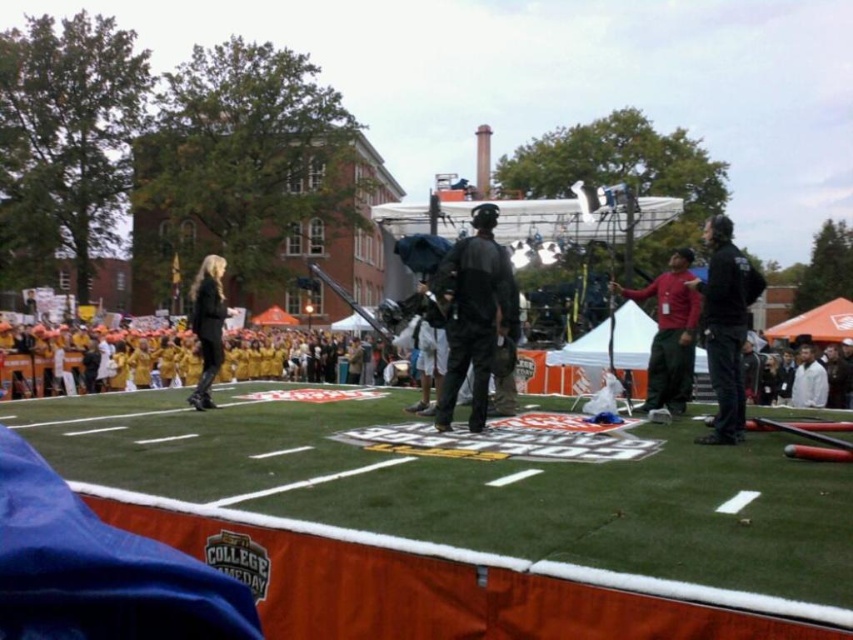
Who is lower down, dark gray fabric jacket at center or red matte shirt at center?

Positioned lower is red matte shirt at center.

Between dark gray fabric jacket at center and red matte shirt at center, which one appears on the right side from the viewer's perspective?

From the viewer's perspective, red matte shirt at center appears more on the right side.

Does point (457, 243) lie behind point (674, 268)?

No, it is not.

Identify the location of dark gray fabric jacket at center. (474, 314).

Who is taller, yellow fabric at center or dark gray fabric jacket at center?

With more height is dark gray fabric jacket at center.

What do you see at coordinates (151, 358) in the screenshot?
I see `yellow fabric at center` at bounding box center [151, 358].

Describe the element at coordinates (151, 358) in the screenshot. I see `yellow fabric at center` at that location.

This screenshot has height=640, width=853. Find the location of `yellow fabric at center`. yellow fabric at center is located at coordinates (151, 358).

Between dark gray fabric jacket at center and white matte jacket at right, which one appears on the right side from the viewer's perspective?

white matte jacket at right

Is point (477, 212) positioned before point (820, 372)?

Yes, point (477, 212) is closer to viewer.

Locate an element on the screen. The width and height of the screenshot is (853, 640). dark gray fabric jacket at center is located at coordinates (474, 314).